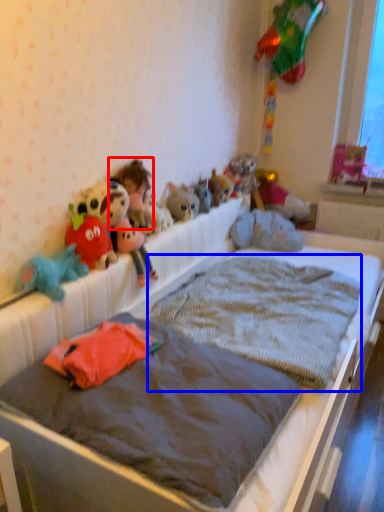
Question: Which point is further to the camera, toy (highlighted by a red box) or mattress (highlighted by a blue box)?

Choices:
 (A) toy
 (B) mattress

Answer: (A)